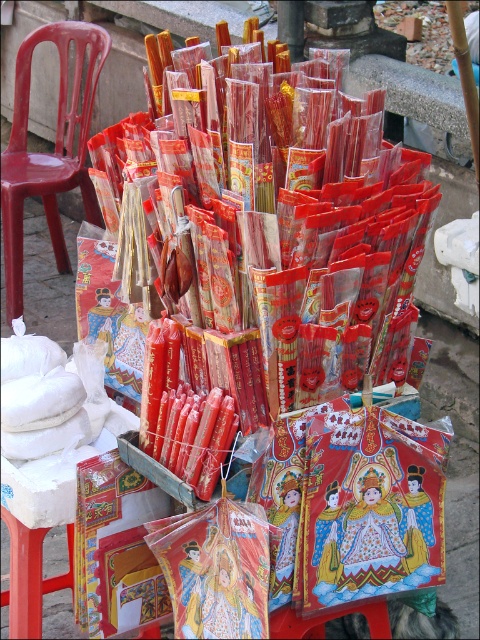
You are standing in front of the street stall and want to determine the relative positions of two points marked in the image. Which point, point (362, 129) or point (20, 177), is closer to you?

Point (362, 129) is closer to the viewer than point (20, 177).

You are a delivery person with a cart that is 2 feet wide. You need to navigate through the space between the matte red incense sticks at center and the matte plastic chair at left. Can your cart fit through the gap between them?

The matte red incense sticks at center and matte plastic chair at left are 6.17 feet apart from each other. Since the cart is only 2 feet wide, there is sufficient space for the cart to pass through the gap between them.

You are setting up a temporary stall and need to place the matte red incense sticks at center and the matte plastic chair at left. Given their sizes, which object should you position first to ensure they fit properly?

The matte red incense sticks at center are wider than the matte plastic chair at left, so you should position the matte red incense sticks at center first to ensure they fit properly.